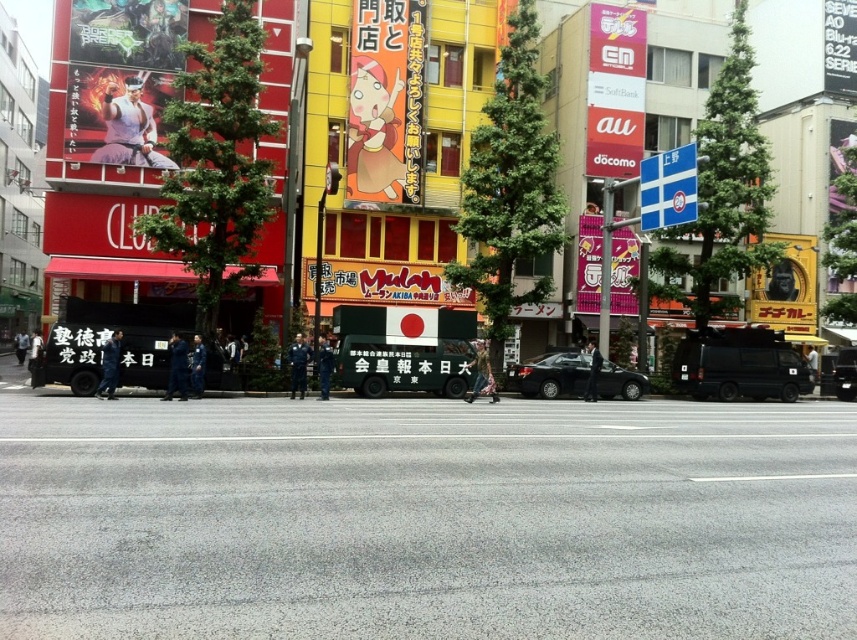
Is black matte van at right shorter than yellow matte gorilla head at upper right?

Yes, black matte van at right is shorter than yellow matte gorilla head at upper right.

Between black matte van at right and yellow matte gorilla head at upper right, which one appears on the left side from the viewer's perspective?

black matte van at right is more to the left.

Is point (746, 348) closer to camera compared to point (817, 252)?

Yes, point (746, 348) is closer to viewer.

Where is `black matte van at right`? This screenshot has height=640, width=857. black matte van at right is located at coordinates (738, 364).

Can you confirm if pink glossy poster at center is positioned to the right of blue plastic sign at upper right?

Incorrect, pink glossy poster at center is not on the right side of blue plastic sign at upper right.

Who is taller, pink glossy poster at center or blue plastic sign at upper right?

Standing taller between the two is pink glossy poster at center.

Where is `pink glossy poster at center`? pink glossy poster at center is located at coordinates (589, 262).

This screenshot has height=640, width=857. Identify the location of pink glossy poster at center. (589, 262).

Does point (630, 97) lie in front of point (802, 272)?

Yes, point (630, 97) is in front of point (802, 272).

Between pink matte sign at upper center and yellow matte gorilla head at upper right, which one is positioned lower?

yellow matte gorilla head at upper right

Describe the element at coordinates (615, 90) in the screenshot. The height and width of the screenshot is (640, 857). I see `pink matte sign at upper center` at that location.

This screenshot has width=857, height=640. What are the coordinates of `pink matte sign at upper center` in the screenshot? It's located at click(x=615, y=90).